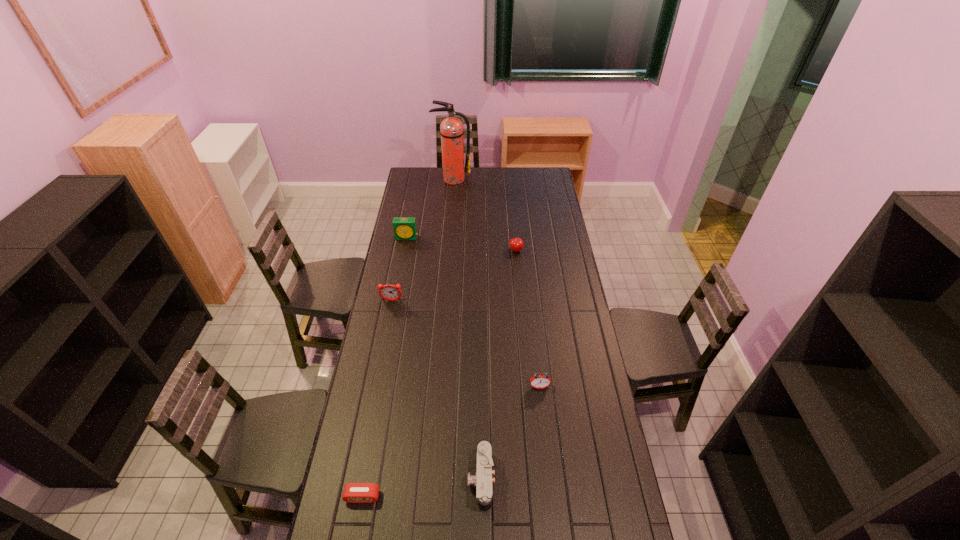
This screenshot has height=540, width=960. What are the coordinates of `the tallest object` in the screenshot? It's located at (451, 129).

The width and height of the screenshot is (960, 540). I want to click on the farthest object, so (451, 129).

Identify the location of the farthest alarm clock. The height and width of the screenshot is (540, 960). (404, 228).

Find the location of a particular element. This screenshot has height=540, width=960. the second farthest alarm clock is located at coordinates (388, 292).

You are a GUI agent. You are given a task and a screenshot of the screen. Output one action in this format:
    pyautogui.click(x=<x>, y=<y>)
    Task: Click on the third nearest object
    
    Given the screenshot: What is the action you would take?
    pyautogui.click(x=540, y=380)

The image size is (960, 540). What are the coordinates of `the third farthest alarm clock` in the screenshot? It's located at (540, 380).

Where is `cherry`? The height and width of the screenshot is (540, 960). cherry is located at coordinates (516, 244).

Find the location of a particular element. The width and height of the screenshot is (960, 540). the third object from right to left is located at coordinates (483, 479).

Where is `the shortest alarm clock`? This screenshot has width=960, height=540. the shortest alarm clock is located at coordinates (353, 492).

Where is `the nearest alarm clock`? the nearest alarm clock is located at coordinates (353, 492).